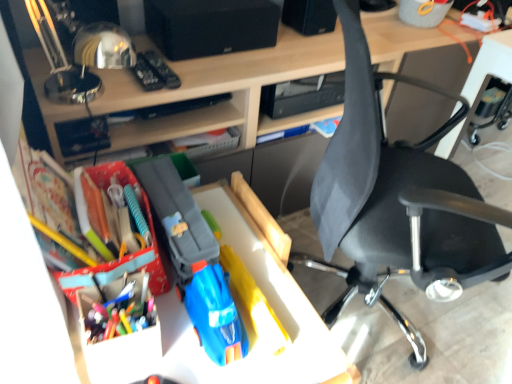
Question: Should I look upward or downward to see matte plastic toy car at center?

Choices:
 (A) up
 (B) down

Answer: (B)

Question: Can you confirm if black fabric chair at right is wider than matte plastic desk at center?

Choices:
 (A) yes
 (B) no

Answer: (A)

Question: Is black fabric chair at right turned away from matte plastic desk at center?

Choices:
 (A) yes
 (B) no

Answer: (A)

Question: Is black fabric chair at right further to camera compared to matte plastic desk at center?

Choices:
 (A) yes
 (B) no

Answer: (B)

Question: Can we say black fabric chair at right lies outside matte plastic desk at center?

Choices:
 (A) no
 (B) yes

Answer: (B)

Question: Does black fabric chair at right touch matte plastic desk at center?

Choices:
 (A) yes
 (B) no

Answer: (B)

Question: Is black fabric chair at right to the left of matte plastic desk at center from the viewer's perspective?

Choices:
 (A) no
 (B) yes

Answer: (A)

Question: From the image's perspective, is multicolored plastic pen at center left on top of matte plastic toy car at center?

Choices:
 (A) no
 (B) yes

Answer: (B)

Question: From a real-world perspective, is multicolored plastic pen at center left under matte plastic toy car at center?

Choices:
 (A) yes
 (B) no

Answer: (B)

Question: Is multicolored plastic pen at center left looking in the opposite direction of matte plastic toy car at center?

Choices:
 (A) no
 (B) yes

Answer: (A)

Question: Does multicolored plastic pen at center left have a smaller size compared to matte plastic toy car at center?

Choices:
 (A) no
 (B) yes

Answer: (B)

Question: Is multicolored plastic pen at center left positioned in front of matte plastic toy car at center?

Choices:
 (A) no
 (B) yes

Answer: (A)

Question: Is multicolored plastic pen at center left placed right next to matte plastic toy car at center?

Choices:
 (A) yes
 (B) no

Answer: (B)

Question: Is matte plastic desk at center to the left of matte plastic toy car at center from the viewer's perspective?

Choices:
 (A) yes
 (B) no

Answer: (B)